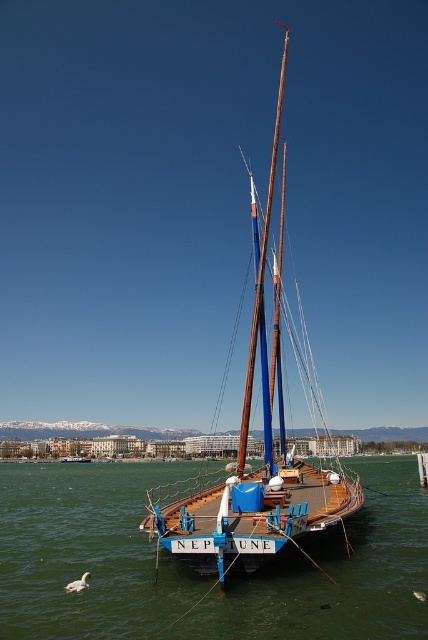
You are standing on the dock and looking at the greenish water at center and the wooden sailboat at center. Which object is closer to you?

The greenish water at center is closer to the viewer than the wooden sailboat at center.

You are standing on the dock next to the Neptune boat. You see the greenish water at center and the brown wooden mast at center. Which object is closer to you?

The greenish water at center is closer to you because it is in front of the brown wooden mast at center.